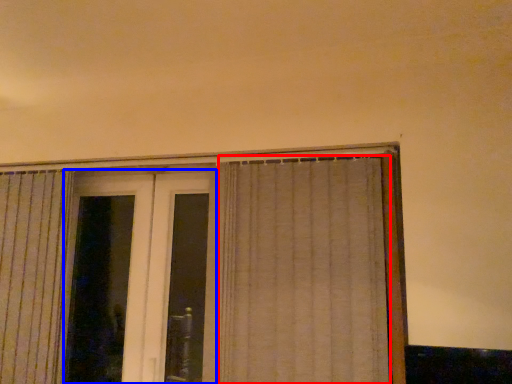
Question: Which object is further to the camera taking this photo, curtain (highlighted by a red box) or screen door (highlighted by a blue box)?

Choices:
 (A) curtain
 (B) screen door

Answer: (B)